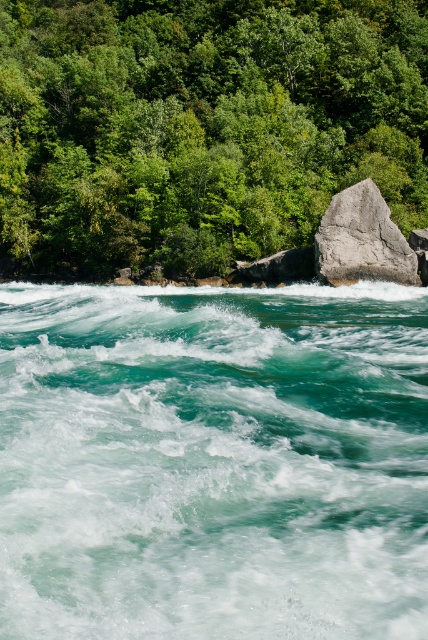
Question: Which point is closer to the camera?

Choices:
 (A) turquoise frothy water at center
 (B) gray rough rock at center
 (C) green leafy trees at upper center

Answer: (A)

Question: Where is turquoise frothy water at center located in relation to green leafy trees at upper center in the image?

Choices:
 (A) above
 (B) below

Answer: (B)

Question: Which of the following is the farthest from the observer?

Choices:
 (A) (222, 115)
 (B) (350, 595)
 (C) (386, 236)

Answer: (A)

Question: Based on their relative distances, which object is farther from the turquoise frothy water at center?

Choices:
 (A) green leafy trees at upper center
 (B) gray rough rock at center

Answer: (A)

Question: Can you confirm if turquoise frothy water at center is positioned above green leafy trees at upper center?

Choices:
 (A) yes
 (B) no

Answer: (B)

Question: Does green leafy trees at upper center have a smaller size compared to gray rough rock at center?

Choices:
 (A) yes
 (B) no

Answer: (B)